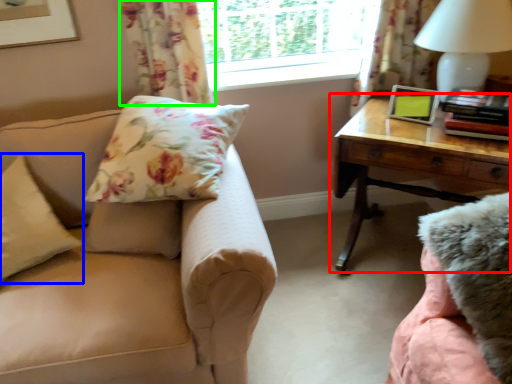
Question: Which object is positioned closest to table (highlighted by a red box)? Select from pillow (highlighted by a blue box) and curtain (highlighted by a green box).

Choices:
 (A) pillow
 (B) curtain

Answer: (B)